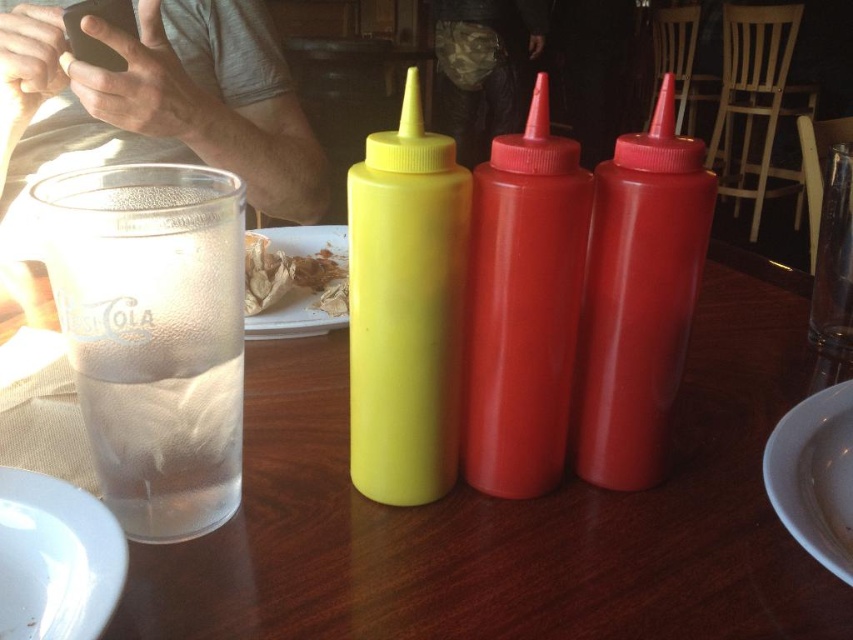
You are a server at the restaurant and need to place a new white ceramic plate at lower right on the table. However, there is already a clear glass cup at left in the way. Can you move the cup to make space for the plate?

The clear glass cup at left is located above the white ceramic plate at lower right, so moving the cup downward would create space for the plate.